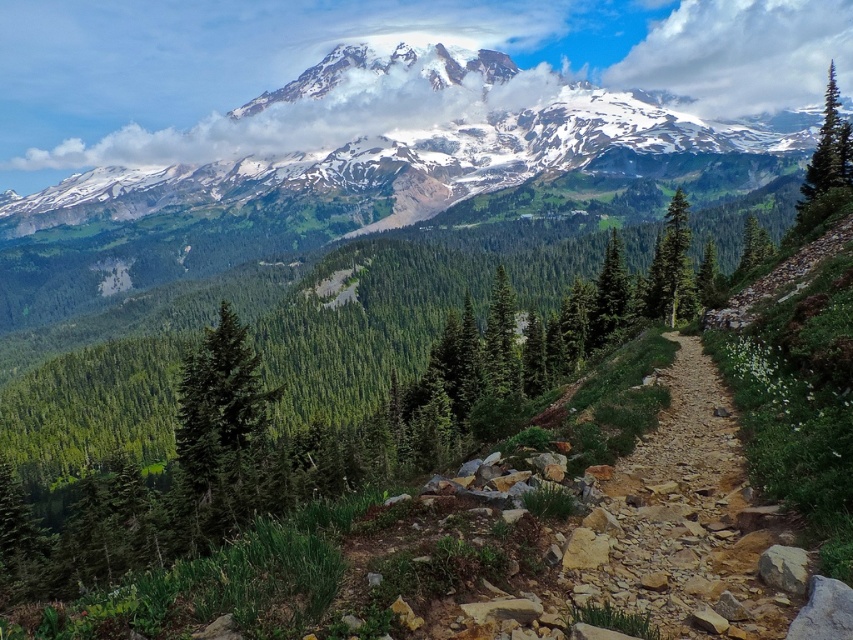
Between snowy granite mountain range at upper center and green textured tree at center, which one appears on the left side from the viewer's perspective?

snowy granite mountain range at upper center

Which is below, snowy granite mountain range at upper center or green textured tree at center?

green textured tree at center

Image resolution: width=853 pixels, height=640 pixels. Identify the location of snowy granite mountain range at upper center. (398, 144).

Between green textured pine tree at upper right and green textured tree at right, which one is positioned lower?

Positioned lower is green textured tree at right.

Who is more forward, [834,160] or [676,228]?

Positioned in front is point [834,160].

Describe the element at coordinates (827, 163) in the screenshot. I see `green textured pine tree at upper right` at that location.

This screenshot has height=640, width=853. In order to click on green textured pine tree at upper right in this screenshot , I will do (827, 163).

Does point (236, 356) come closer to viewer compared to point (664, 284)?

Yes, point (236, 356) is in front of point (664, 284).

Does green matte tree at center-left have a greater width compared to green textured tree at right?

No, green matte tree at center-left is not wider than green textured tree at right.

The height and width of the screenshot is (640, 853). What do you see at coordinates (219, 428) in the screenshot? I see `green matte tree at center-left` at bounding box center [219, 428].

Find the location of a particular element. green matte tree at center-left is located at coordinates (219, 428).